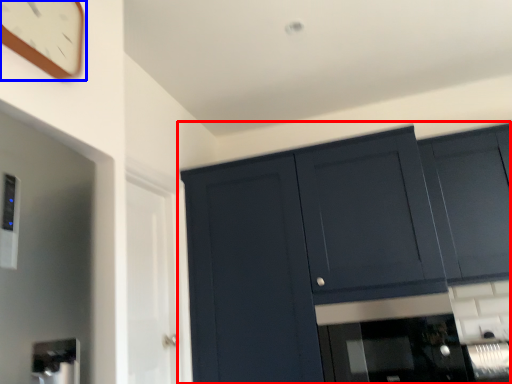
Question: Which object appears farthest to the camera in this image, cupboard (highlighted by a red box) or clock (highlighted by a blue box)?

Choices:
 (A) cupboard
 (B) clock

Answer: (A)